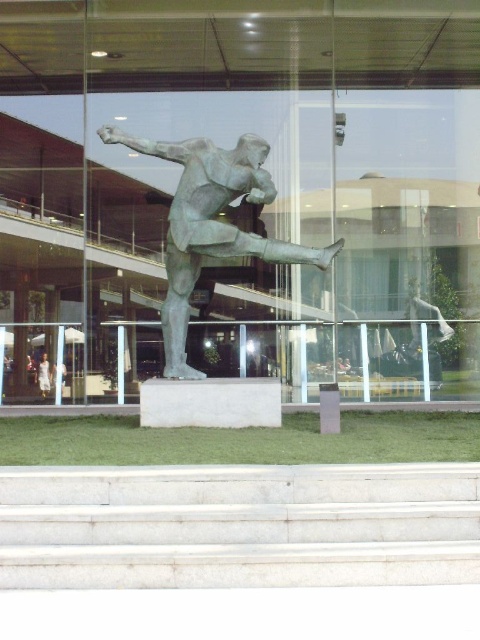
You are standing at the entrance of the building and want to approach the bronze statue. The white marble stairs at center are in your path. In which direction should you move relative to the stairs to reach the statue?

The bronze statue is positioned outdoors in front of the building, so to reach it from the entrance, you should move towards the white marble stairs at center as they are directly in your path leading to the statue.

You are an art curator planning to install a new light fixture above the white marble stairs at center and the green patina statue at center. The light fixture requires a minimum height clearance of 2 meters. Can both objects fit under it without any adjustments?

The white marble stairs at center is shorter than the green patina statue at center. Since the green patina statue at center is taller, if it is under 2 meters, both would fit. However, if the statue exceeds 2 meters, adjustments are needed. The given information does not specify their exact heights, so it is unclear if they meet the 2 meter requirement.